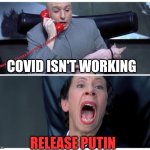
You are a GUI agent. You are given a task and a screenshot of the screen. Output one action in this format:
    pyautogui.click(x=<x>, y=<y>)
    Task: Click on the red phone handset
    The image size is (150, 150).
    Given the screenshot: What is the action you would take?
    pyautogui.click(x=59, y=27)